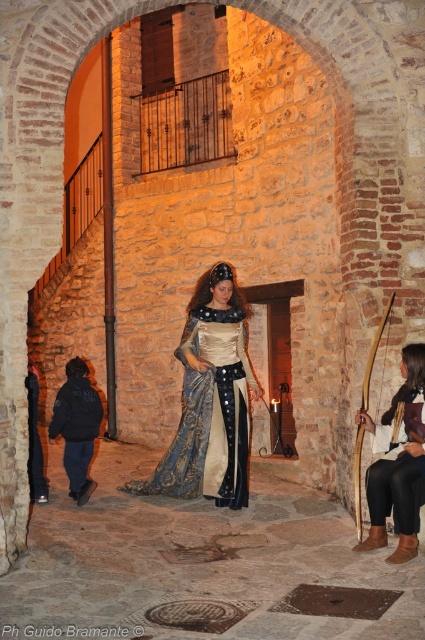
Which is below, silk satin dress at center or dark blue jacket at lower left?

dark blue jacket at lower left is below.

Is the position of silk satin dress at center less distant than that of dark blue jacket at lower left?

Yes.

Who is more forward, (238, 449) or (73, 404)?

Point (238, 449) is in front.

Identify the location of silk satin dress at center. The width and height of the screenshot is (425, 640). (209, 417).

Consider the image. Is dark blue jacket at lower left smaller than wooden bow at center?

Yes, dark blue jacket at lower left is smaller than wooden bow at center.

Who is positioned more to the left, dark blue jacket at lower left or wooden bow at center?

dark blue jacket at lower left

The width and height of the screenshot is (425, 640). I want to click on dark blue jacket at lower left, so click(x=76, y=426).

Is velvet blue dress at lower right wider than wooden bow at center?

Correct, the width of velvet blue dress at lower right exceeds that of wooden bow at center.

Is velvet blue dress at lower right shorter than wooden bow at center?

Correct, velvet blue dress at lower right is not as tall as wooden bow at center.

This screenshot has height=640, width=425. Describe the element at coordinates (397, 461) in the screenshot. I see `velvet blue dress at lower right` at that location.

At what (x,y) coordinates should I click in order to perform the action: click on velvet blue dress at lower right. Please return your answer as a coordinate pair (x, y). The image size is (425, 640). Looking at the image, I should click on (397, 461).